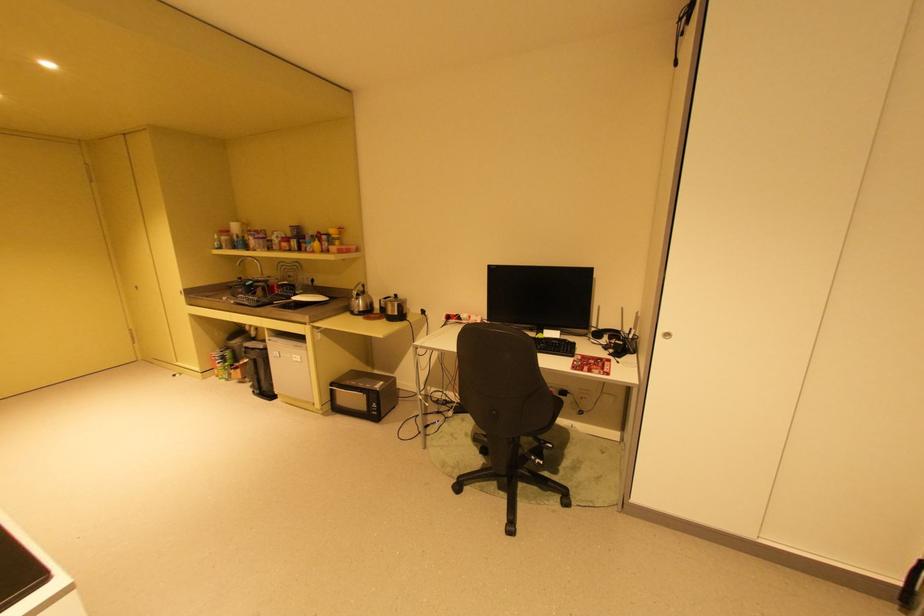
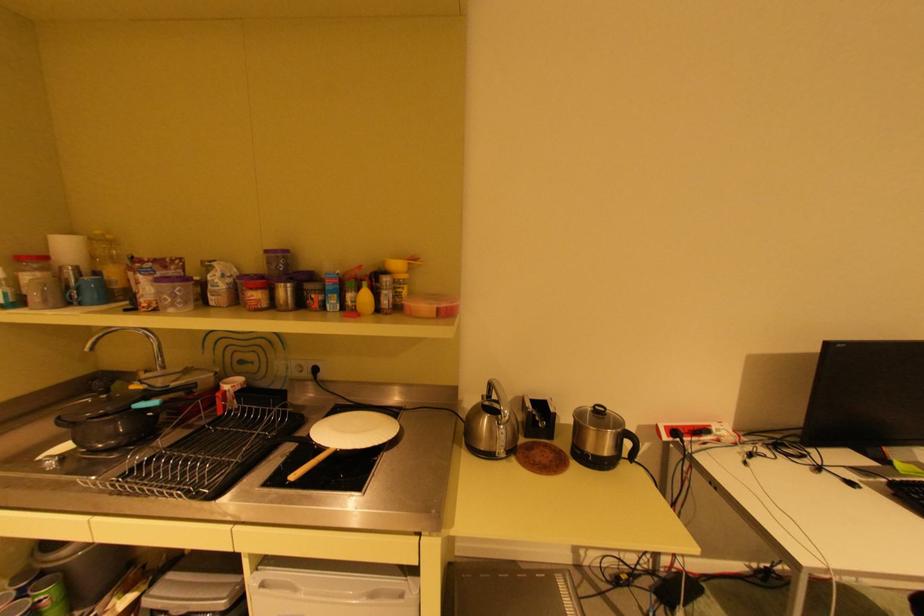
Find the pixel in the second image that matches point 242,249 in the first image.

(79, 302)